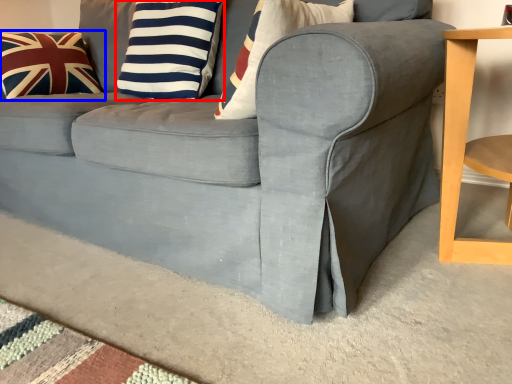
Question: Which object appears farthest to the camera in this image, pillow (highlighted by a red box) or pillow (highlighted by a blue box)?

Choices:
 (A) pillow
 (B) pillow

Answer: (B)